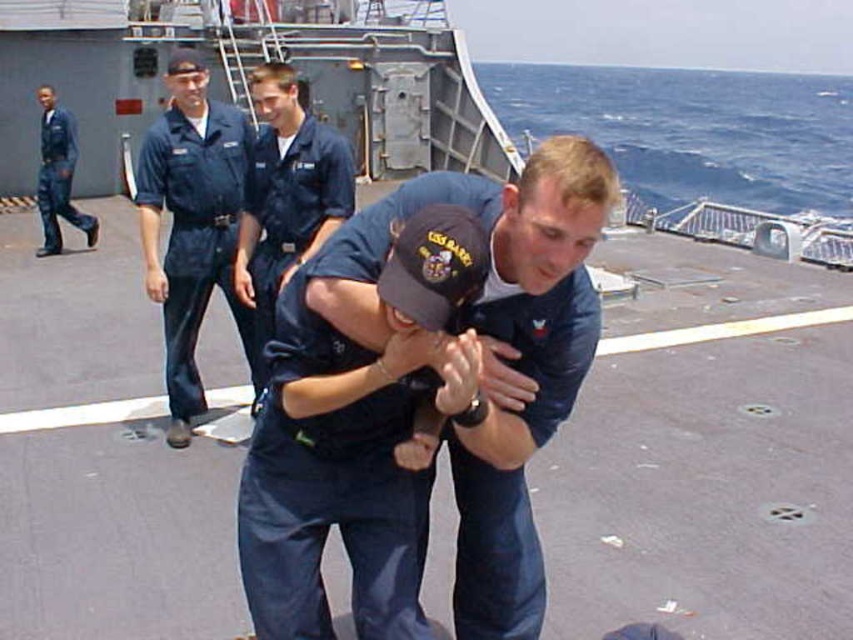
Question: Does navy blue uniform at left come behind blue uniform at left?

Choices:
 (A) yes
 (B) no

Answer: (B)

Question: Which of the following is the closest to the observer?

Choices:
 (A) blue uniform at left
 (B) navy blue uniform at center

Answer: (B)

Question: Among these points, which one is farthest from the camera?

Choices:
 (A) (258, 160)
 (B) (178, 316)
 (C) (357, 416)

Answer: (B)

Question: Is navy blue uniform at center bigger than blue uniform at center?

Choices:
 (A) yes
 (B) no

Answer: (A)

Question: Can you confirm if navy blue uniform at center is positioned to the right of navy blue uniform at left?

Choices:
 (A) yes
 (B) no

Answer: (A)

Question: Based on their relative distances, which object is farther from the blue uniform at center?

Choices:
 (A) blue uniform at left
 (B) navy blue uniform at center

Answer: (A)